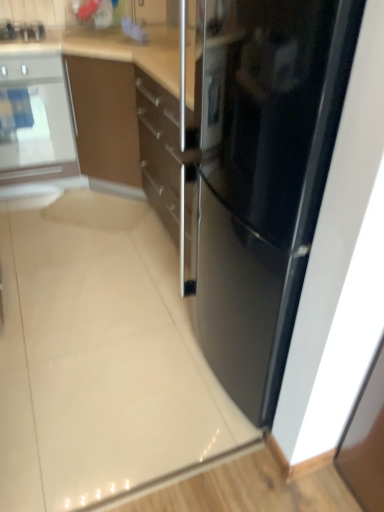
Question: Is sleek stainless steel refrigerator at center smaller than satin silver oven at left?

Choices:
 (A) no
 (B) yes

Answer: (A)

Question: Could you tell me if sleek stainless steel refrigerator at center is turned towards satin silver oven at left?

Choices:
 (A) no
 (B) yes

Answer: (A)

Question: Is sleek stainless steel refrigerator at center positioned with its back to satin silver oven at left?

Choices:
 (A) no
 (B) yes

Answer: (A)

Question: Does sleek stainless steel refrigerator at center have a larger size compared to satin silver oven at left?

Choices:
 (A) yes
 (B) no

Answer: (A)

Question: From the image's perspective, is sleek stainless steel refrigerator at center located beneath satin silver oven at left?

Choices:
 (A) yes
 (B) no

Answer: (A)

Question: Is point (326, 130) closer or farther from the camera than point (59, 90)?

Choices:
 (A) farther
 (B) closer

Answer: (B)

Question: From a real-world perspective, relative to satin silver oven at left, is sleek stainless steel refrigerator at center vertically above or below?

Choices:
 (A) below
 (B) above

Answer: (A)

Question: In the image, is sleek stainless steel refrigerator at center positioned in front of or behind satin silver oven at left?

Choices:
 (A) behind
 (B) front

Answer: (B)

Question: From the image's perspective, is sleek stainless steel refrigerator at center located above or below satin silver oven at left?

Choices:
 (A) above
 (B) below

Answer: (B)

Question: From the image's perspective, relative to satin silver oven at left, is brushed metal toaster at upper left above or below?

Choices:
 (A) above
 (B) below

Answer: (A)

Question: Considering the positions of brushed metal toaster at upper left and satin silver oven at left in the image, is brushed metal toaster at upper left bigger or smaller than satin silver oven at left?

Choices:
 (A) big
 (B) small

Answer: (B)

Question: In terms of height, does brushed metal toaster at upper left look taller or shorter compared to satin silver oven at left?

Choices:
 (A) short
 (B) tall

Answer: (A)

Question: Do you think brushed metal toaster at upper left is within satin silver oven at left, or outside of it?

Choices:
 (A) outside
 (B) inside

Answer: (B)

Question: In terms of width, does sleek stainless steel refrigerator at center look wider or thinner when compared to brushed metal toaster at upper left?

Choices:
 (A) wide
 (B) thin

Answer: (A)

Question: Visually, is sleek stainless steel refrigerator at center positioned to the left or to the right of brushed metal toaster at upper left?

Choices:
 (A) left
 (B) right

Answer: (B)